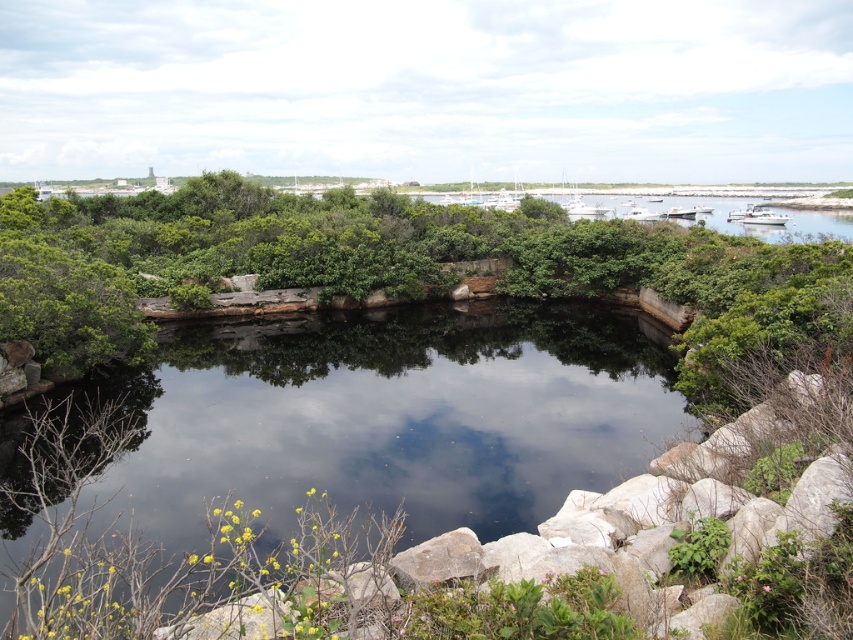
Question: Is clear water at center closer to the viewer compared to green leafy river at upper center?

Choices:
 (A) no
 (B) yes

Answer: (B)

Question: Can you confirm if clear water at center is thinner than green leafy river at upper center?

Choices:
 (A) yes
 (B) no

Answer: (A)

Question: Does clear water at center have a smaller size compared to green leafy river at upper center?

Choices:
 (A) no
 (B) yes

Answer: (B)

Question: Among these points, which one is nearest to the camera?

Choices:
 (A) (714, 211)
 (B) (196, 472)

Answer: (B)